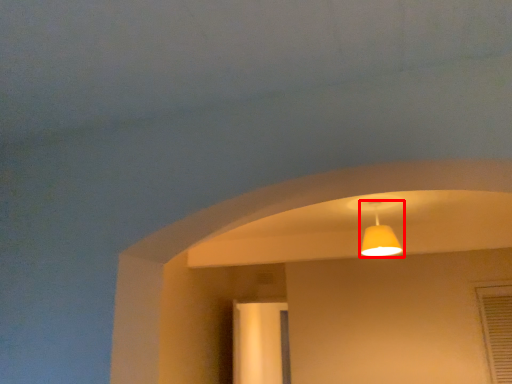
Question: From the image's perspective, where is lamp (annotated by the red box) located in relation to screen door in the image?

Choices:
 (A) above
 (B) below

Answer: (A)